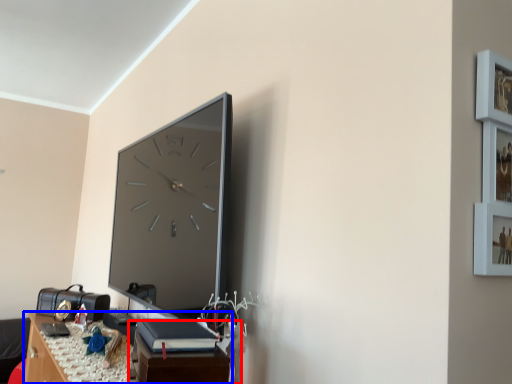
Question: Which object appears closest to the camera in this image, table (highlighted by a red box) or table (highlighted by a blue box)?

Choices:
 (A) table
 (B) table

Answer: (A)